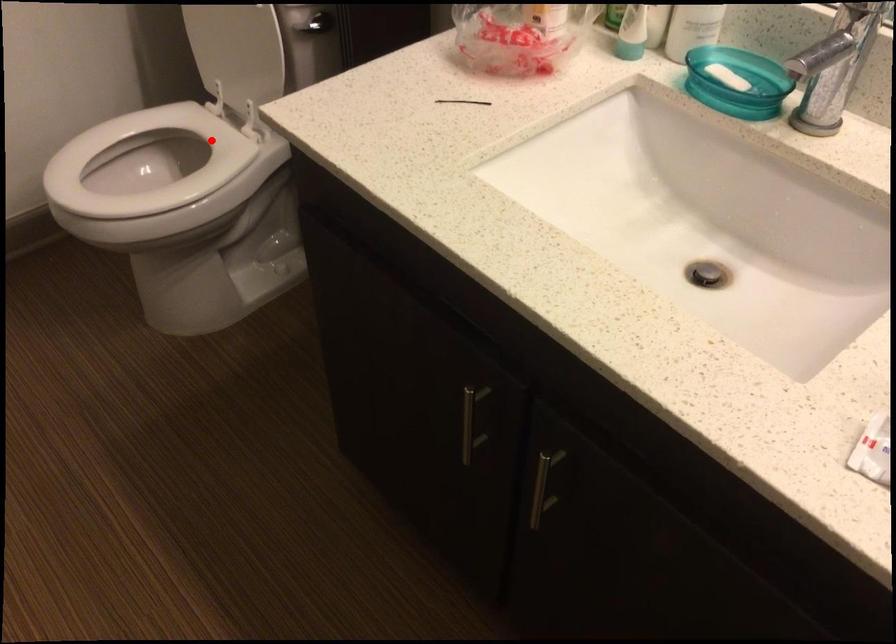
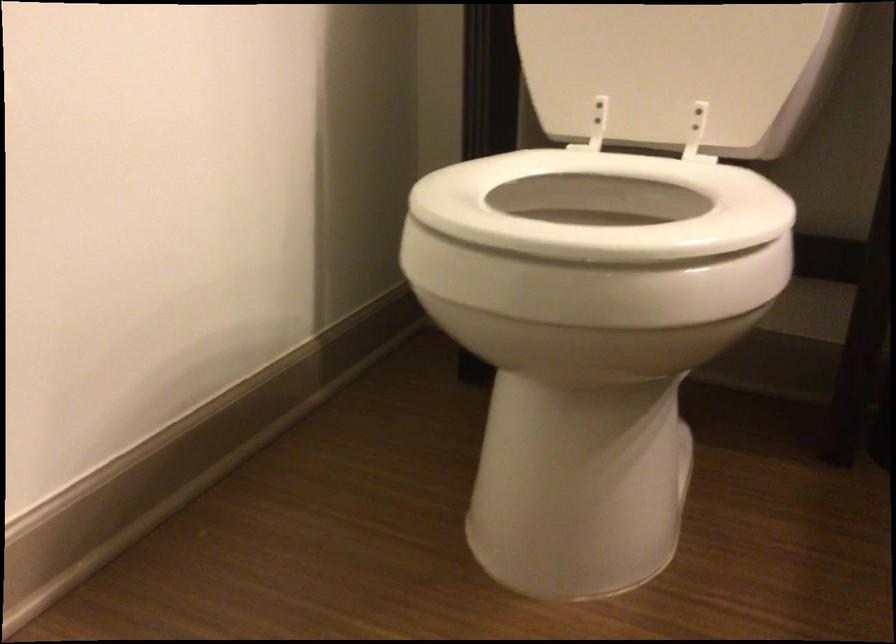
Question: A red point is marked in image1. In image2, is the corresponding 3D point closer to the camera or farther? Reply with the corresponding letter.

Choices:
 (A) The corresponding 3D point is closer.
 (B) The corresponding 3D point is farther.

Answer: (A)